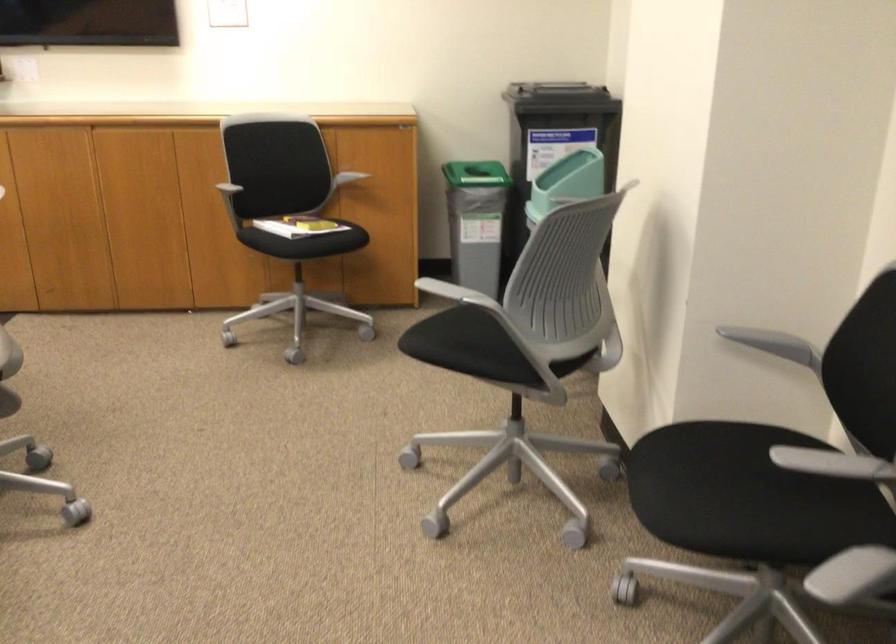
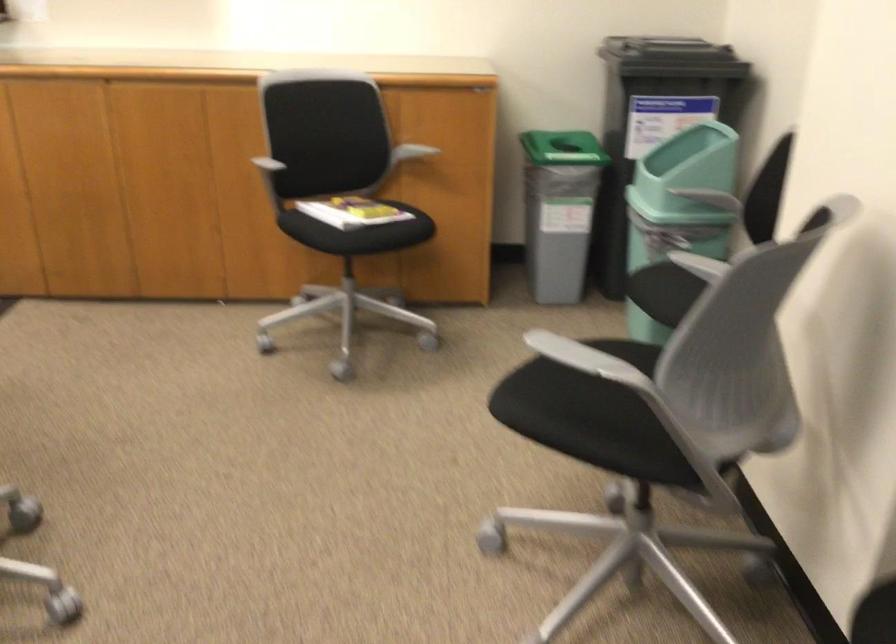
The point at (305,240) is marked in the first image. Where is the corresponding point in the second image?

(358, 232)